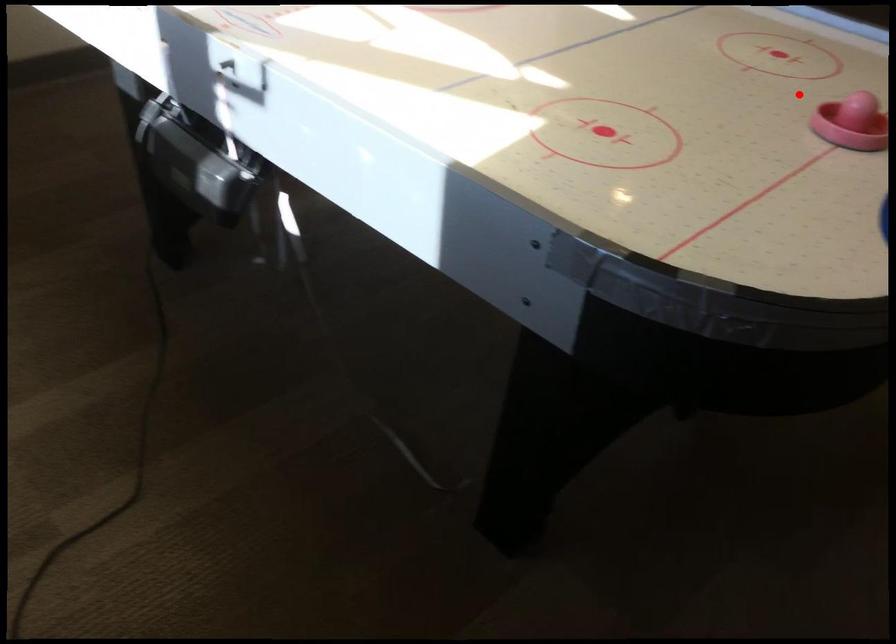
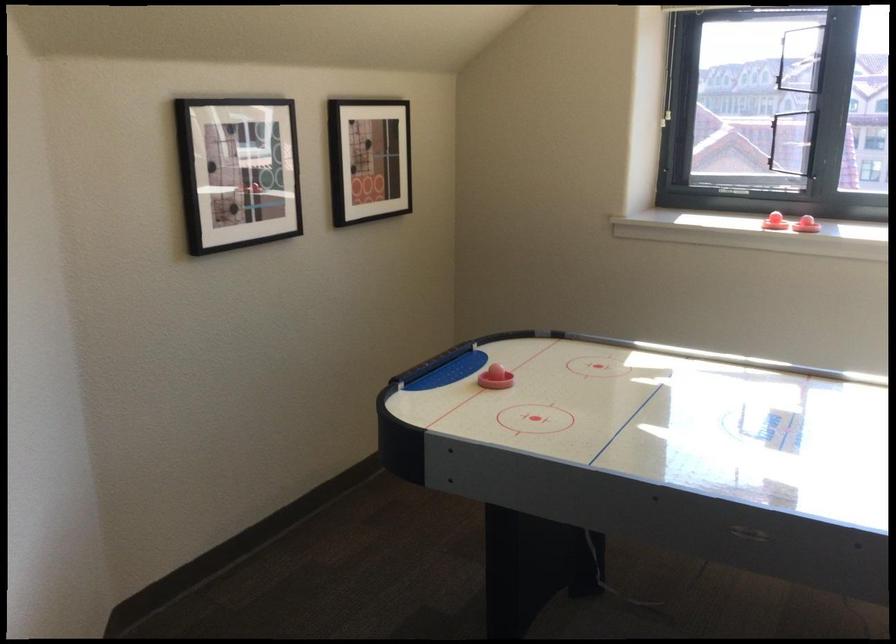
Question: I am providing you with two images of the same scene from different viewpoints. Given a red point in image1, look at the same physical point in image2. Is it:

Choices:
 (A) Closer to the viewpoint
 (B) Farther from the viewpoint

Answer: (B)